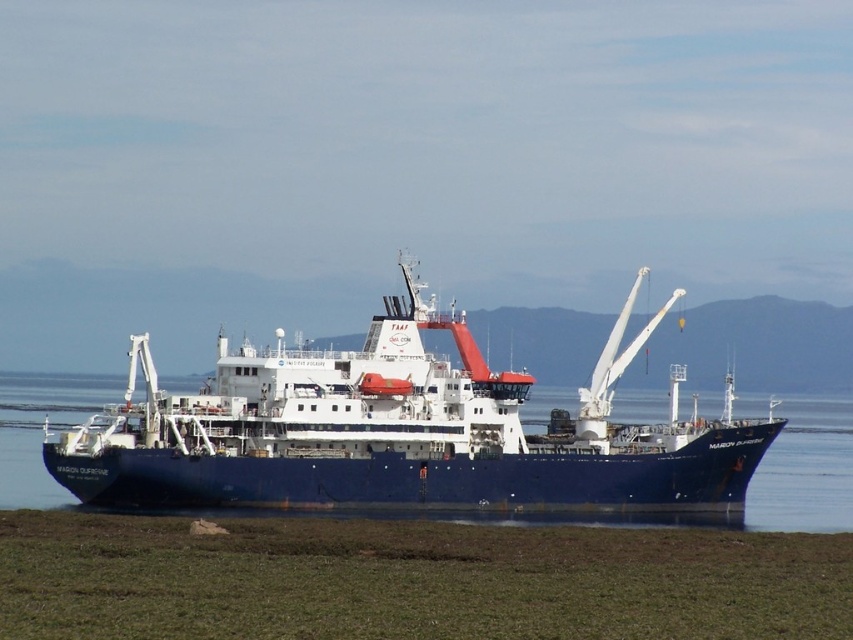
Between blue matte ship at center and blue glossy water at center, which one is positioned lower?

blue glossy water at center is below.

Is blue matte ship at center shorter than blue glossy water at center?

Incorrect, blue matte ship at center's height does not fall short of blue glossy water at center's.

Is point (375, 493) farther from camera compared to point (32, 419)?

That is False.

Locate an element on the screen. The height and width of the screenshot is (640, 853). blue matte ship at center is located at coordinates (399, 432).